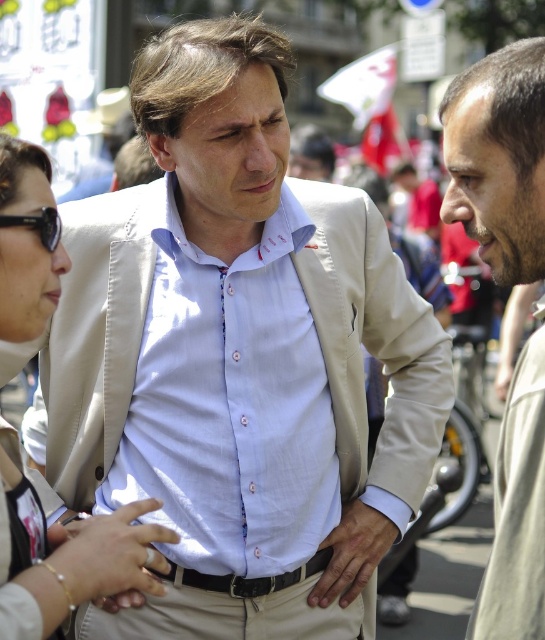
You are a fashion stylist preparing to take a photo of a client wearing a gold bracelet at lower left and black plastic sunglasses at left. Since you want to ensure both accessories are visible, which one should you adjust to be closer to the camera to make both visible?

Since the gold bracelet at lower left is larger in size than black plastic sunglasses at left, you should move the black plastic sunglasses at left closer to the camera to ensure both accessories are visible.

You are a fashion designer analyzing the image. You need to determine which item takes up more visual space in the composition. Which object is larger in size between the matte beige vest at center and the black plastic sunglasses at left?

The matte beige vest at center is bigger than the black plastic sunglasses at left, so the matte beige vest at center takes up more visual space in the composition.